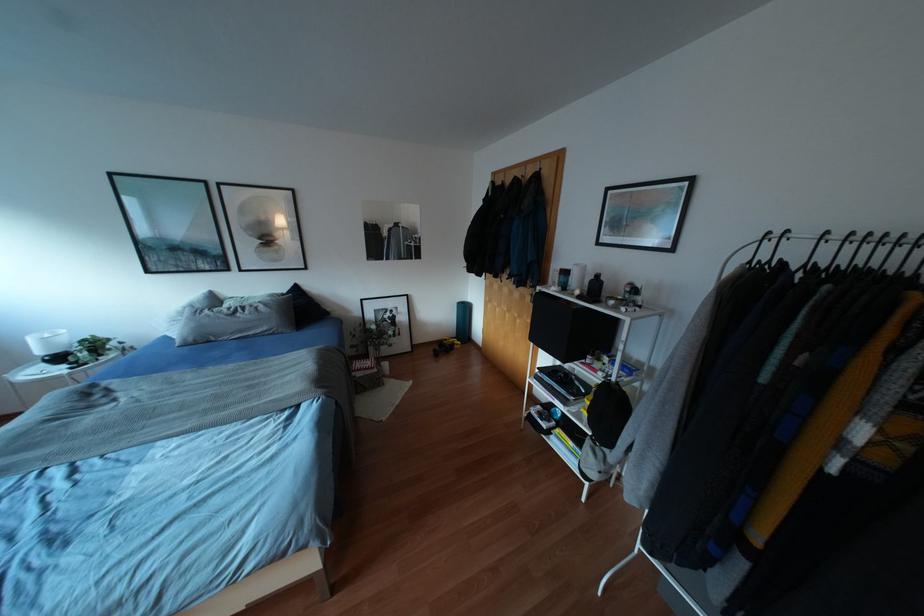
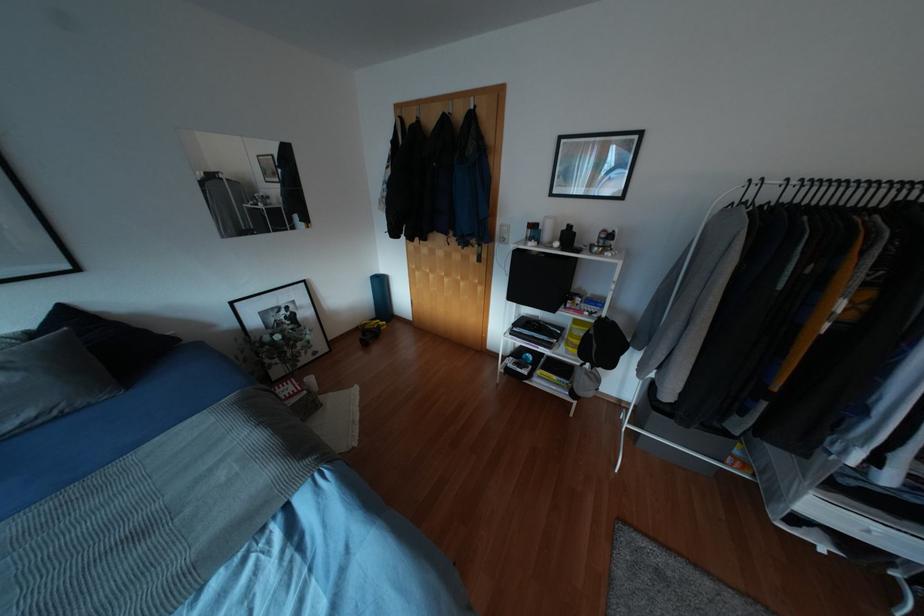
Question: Based on the continuous images, in which direction is the camera rotating? Reply with the corresponding letter.

Choices:
 (A) Left
 (B) Right
 (C) Up
 (D) Down

Answer: (B)